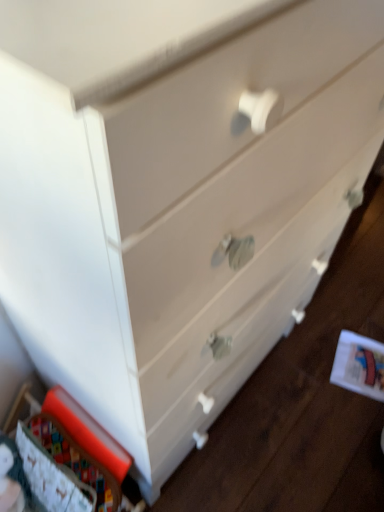
Locate an element on the screen. This screenshot has width=384, height=512. plastic orange infant bed at lower left is located at coordinates (83, 449).

Describe the element at coordinates (83, 449) in the screenshot. I see `plastic orange infant bed at lower left` at that location.

Where is `plastic orange infant bed at lower left`? This screenshot has width=384, height=512. plastic orange infant bed at lower left is located at coordinates 83,449.